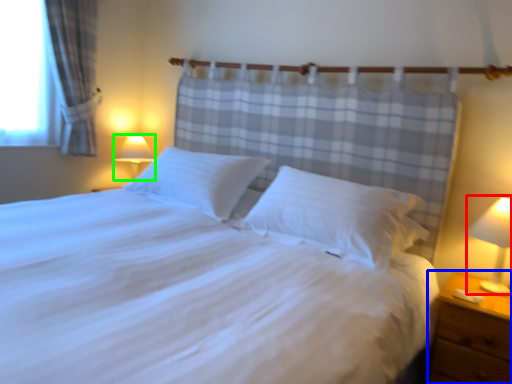
Question: Which is farther away from bedside lamp (highlighted by a red box)? nightstand (highlighted by a blue box) or lamp (highlighted by a green box)?

Choices:
 (A) nightstand
 (B) lamp

Answer: (B)